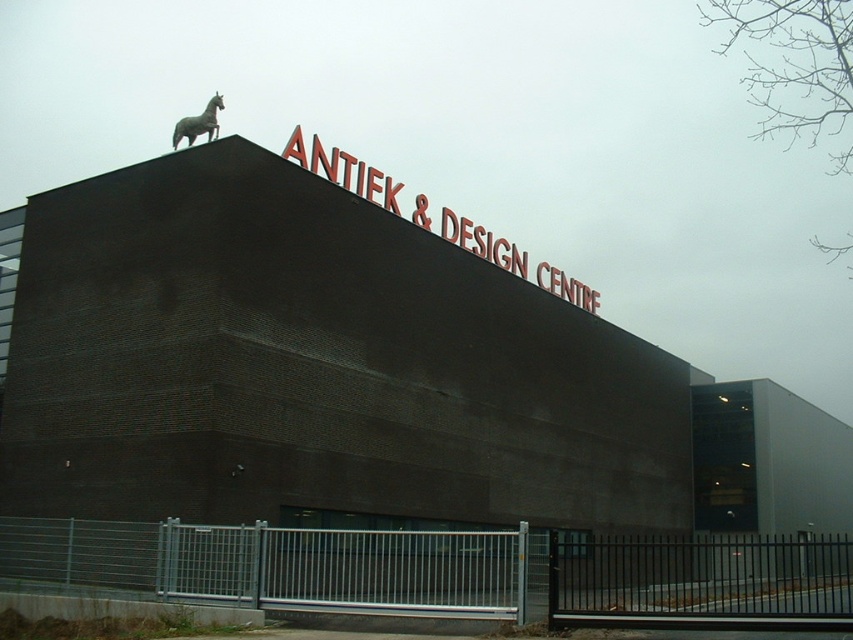
Question: Among these points, which one is nearest to the camera?

Choices:
 (A) pyautogui.click(x=358, y=168)
 (B) pyautogui.click(x=477, y=602)
 (C) pyautogui.click(x=189, y=125)

Answer: (B)

Question: Does metallic silver fence at lower center lie in front of red metallic sign at upper center?

Choices:
 (A) no
 (B) yes

Answer: (B)

Question: Which object is closer to the camera taking this photo?

Choices:
 (A) metallic horse at upper center
 (B) red metallic sign at upper center
 (C) metallic silver fence at lower center

Answer: (C)

Question: From the image, what is the correct spatial relationship of metallic silver fence at lower center in relation to red metallic sign at upper center?

Choices:
 (A) above
 (B) below

Answer: (B)

Question: Which object is positioned farthest from the red metallic sign at upper center?

Choices:
 (A) metallic horse at upper center
 (B) metallic silver fence at lower center

Answer: (B)

Question: From the image, what is the correct spatial relationship of metallic silver fence at lower center in relation to red metallic sign at upper center?

Choices:
 (A) above
 (B) below

Answer: (B)